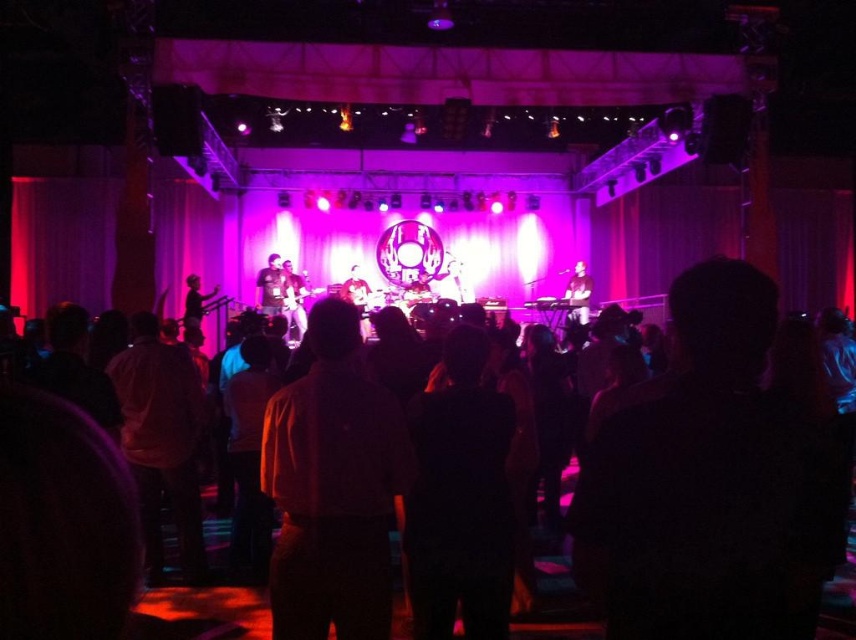
You are a photographer at the concert. You want to capture a photo of both the orange shirt at center and the dark brown shirt at center in the same frame. Based on their positions, can you fit both shirts into the camera view without moving the camera?

The orange shirt at center might be wider than dark brown shirt at center, so it is uncertain if both can fit into the camera view without moving the camera. The photographer should check the distance and angle to ensure both shirts are within the frame.

You are at a concert and see the stage with a band performing. There is a point marked at coordinates [333,486]. What object or person is located at that point?

The orange shirt at center is located at point [333,486].

You are at the concert and want to find someone wearing an orange shirt at center. According to the coordinates provided, where should you look relative to the stage?

The orange shirt at center is located at point coordinates 0.761 on the x axis and 0.390 on the y axis, so you should look towards the center area slightly to the right of the stage.